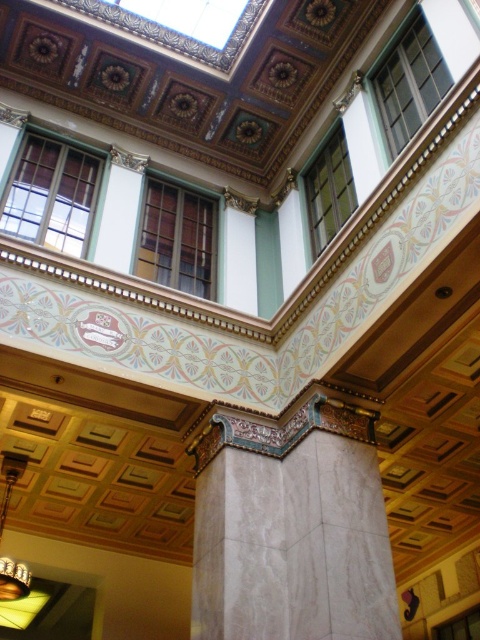
Question: Which object appears farthest from the camera in this image?

Choices:
 (A) white marble column at center
 (B) gold metallic chandelier at lower left

Answer: (B)

Question: Which point is closer to the camera?

Choices:
 (A) white marble column at center
 (B) gold metallic chandelier at lower left

Answer: (A)

Question: Where is white marble column at center located in relation to gold metallic chandelier at lower left in the image?

Choices:
 (A) left
 (B) right

Answer: (B)

Question: Can you confirm if white marble column at center is positioned below gold metallic chandelier at lower left?

Choices:
 (A) no
 (B) yes

Answer: (A)

Question: Does white marble column at center appear over gold metallic chandelier at lower left?

Choices:
 (A) no
 (B) yes

Answer: (B)